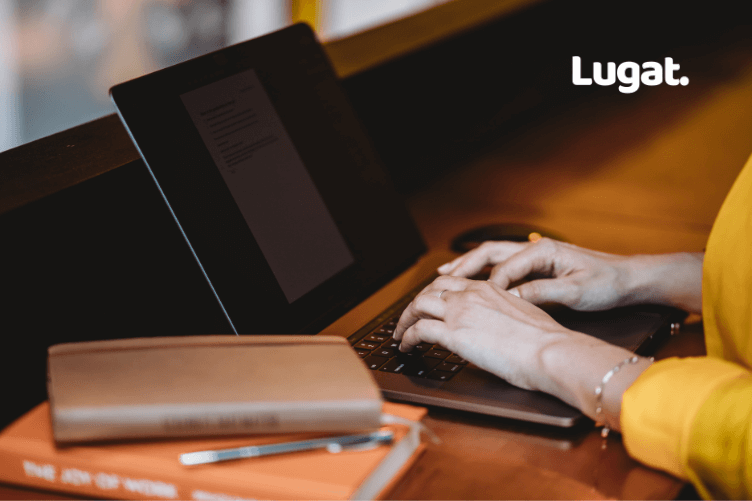
Locate an element on the screen. desk top between keyboard and display is located at coordinates (374, 307).